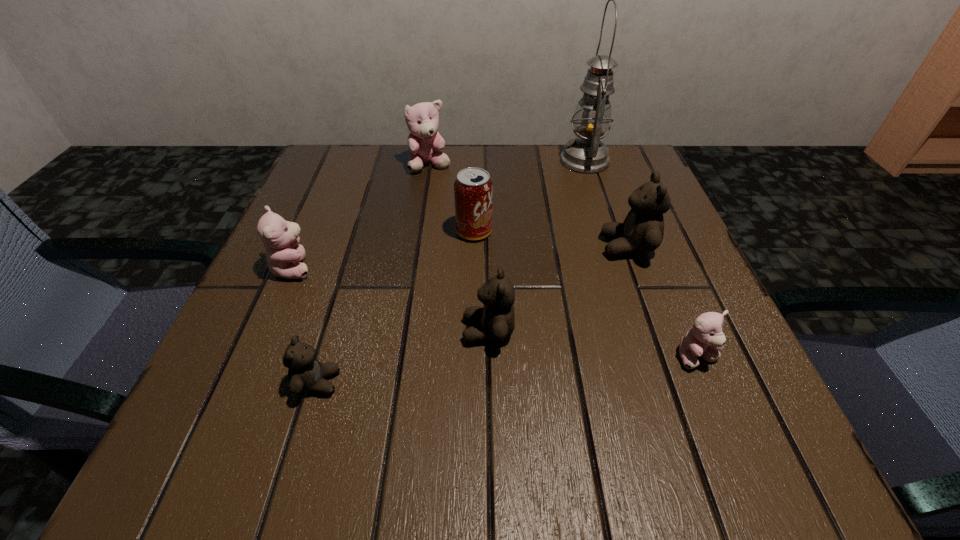
Locate an element on the screen. vacant space located 0.290m on the right of the red soda can is located at coordinates (640, 232).

You are a GUI agent. You are given a task and a screenshot of the screen. Output one action in this format:
    pyautogui.click(x=<x>, y=<y>)
    Task: Click on the free location located 0.230m on the face of the second brown teddy bear from right to left
    
    Given the screenshot: What is the action you would take?
    pyautogui.click(x=315, y=331)

This screenshot has height=540, width=960. In order to click on vacant space located on the face of the second brown teddy bear from right to left in this screenshot , I will do `click(264, 331)`.

This screenshot has height=540, width=960. I want to click on vacant area situated on the face of the second brown teddy bear from right to left, so click(296, 331).

Where is `vacant space located at the face of the second smallest pink teddy bear`? The height and width of the screenshot is (540, 960). vacant space located at the face of the second smallest pink teddy bear is located at coordinates (393, 267).

The height and width of the screenshot is (540, 960). I want to click on free point located 0.400m on the face of the smallest brown teddy bear, so click(x=622, y=382).

Where is `free space located 0.060m at the face of the rightmost pink teddy bear`? free space located 0.060m at the face of the rightmost pink teddy bear is located at coordinates (719, 411).

Image resolution: width=960 pixels, height=540 pixels. In order to click on oil lamp at the far edge in this screenshot , I will do `click(586, 154)`.

The width and height of the screenshot is (960, 540). In order to click on teddy bear located in the far edge section of the desktop in this screenshot , I will do `click(424, 141)`.

Find the location of a particular element. oil lamp that is at the right edge is located at coordinates (586, 154).